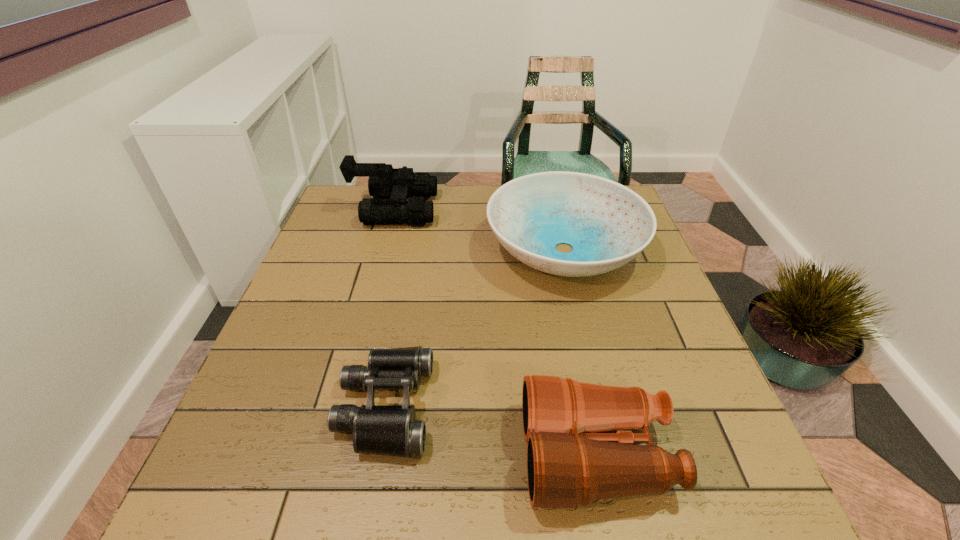
Locate an element on the screen. This screenshot has width=960, height=540. blank space located on the front-facing side of the shortest object is located at coordinates (477, 407).

Identify the location of binoculars that is at the far edge. (398, 184).

Locate an element on the screen. dish present at the far edge is located at coordinates (607, 224).

The image size is (960, 540). I want to click on object that is at the near edge, so click(568, 464).

Locate an element on the screen. object present at the left edge is located at coordinates (398, 184).

Locate an element on the screen. Image resolution: width=960 pixels, height=540 pixels. dish present at the right edge is located at coordinates (607, 224).

I want to click on binoculars situated at the right edge, so click(568, 464).

I want to click on object that is at the far left corner, so click(x=398, y=184).

Locate an element on the screen. This screenshot has width=960, height=540. object at the far right corner is located at coordinates (607, 224).

You are a GUI agent. You are given a task and a screenshot of the screen. Output one action in this format:
    pyautogui.click(x=<x>, y=<y>)
    Task: Click on the object situated at the near right corner
    
    Given the screenshot: What is the action you would take?
    pyautogui.click(x=568, y=464)